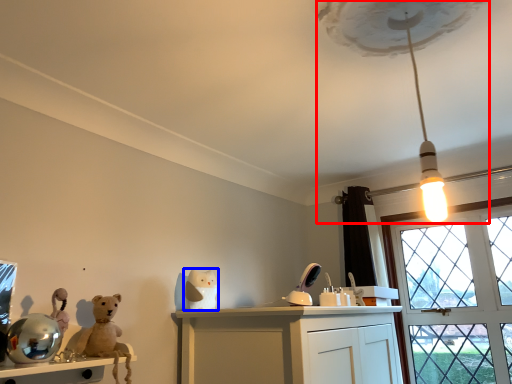
Question: Which object is closer to the camera taking this photo, lamp (highlighted by a red box) or toy (highlighted by a blue box)?

Choices:
 (A) lamp
 (B) toy

Answer: (A)